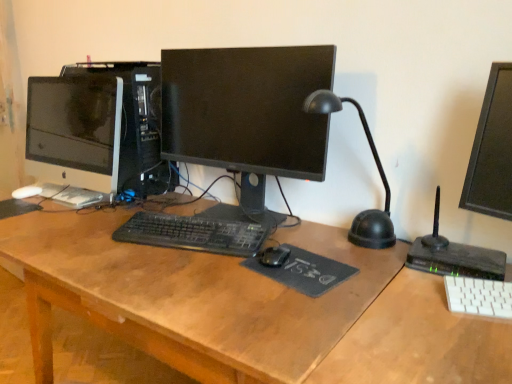
The width and height of the screenshot is (512, 384). What are the coordinates of `vacant region in front of black fabric mousepad at center, positioned as the 2th mousepad in back-to-front order` in the screenshot? It's located at 305,306.